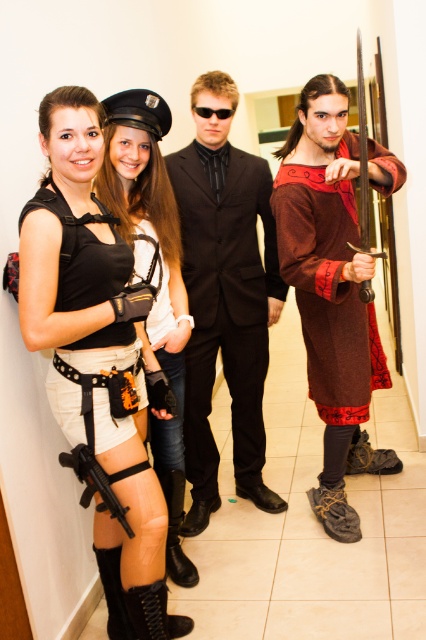
Is black satin suit at center above matte black vest at left?

Yes.

Who is higher up, black satin suit at center or matte black vest at left?

Positioned higher is black satin suit at center.

Where is `black satin suit at center`? black satin suit at center is located at coordinates (226, 308).

Is point (210, 316) positioned after point (365, 385)?

Yes, point (210, 316) is behind point (365, 385).

Does black satin suit at center have a lesser width compared to brown woven fabric tunic at right?

Yes.

Identify the location of black satin suit at center. Image resolution: width=426 pixels, height=640 pixels. (226, 308).

Measure the distance from brown woven fabric tunic at right to black plastic goggles at center.

brown woven fabric tunic at right and black plastic goggles at center are 33.68 inches apart from each other.

Based on the photo, does brown woven fabric tunic at right appear on the left side of black plastic goggles at center?

In fact, brown woven fabric tunic at right is to the right of black plastic goggles at center.

Does point (316, 195) lie in front of point (218, 116)?

That is True.

This screenshot has width=426, height=640. I want to click on brown woven fabric tunic at right, so click(328, 291).